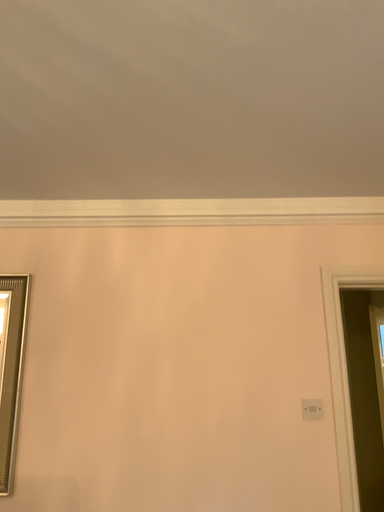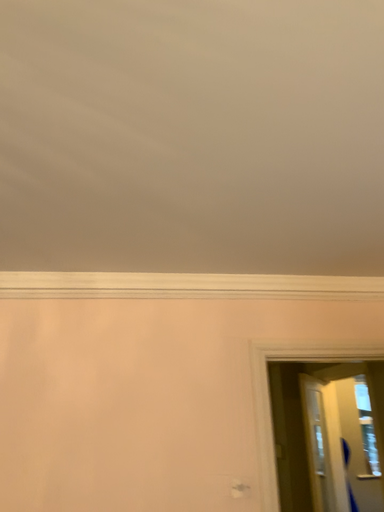
Question: How did the camera likely rotate when shooting the video?

Choices:
 (A) rotated downward
 (B) rotated upward

Answer: (B)